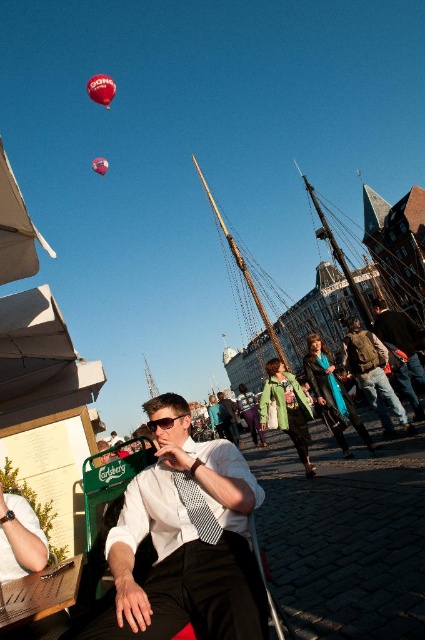
Question: Can you confirm if white checkered dress shirt at center is smaller than shiny red balloon at upper left?

Choices:
 (A) no
 (B) yes

Answer: (B)

Question: Estimate the real-world distances between objects in this image. Which object is closer to the leather jacket at center?

Choices:
 (A) matte white shirt at center
 (B) black plastic sunglasses at center
 (C) brown leather jacket at center
 (D) wooden ship at center

Answer: (C)

Question: Is white checkered dress shirt at center thinner than leather jacket at center?

Choices:
 (A) no
 (B) yes

Answer: (A)

Question: Which of the following is the farthest from the observer?

Choices:
 (A) (221, 449)
 (B) (421, 413)
 (C) (235, 436)
 (D) (201, 497)

Answer: (C)

Question: Which point is closer to the camera?

Choices:
 (A) (164, 490)
 (B) (121, 536)
 (C) (104, 173)
 (D) (410, 330)

Answer: (B)

Question: Is matte white shirt at center wider than red glossy balloon at upper center?

Choices:
 (A) no
 (B) yes

Answer: (A)